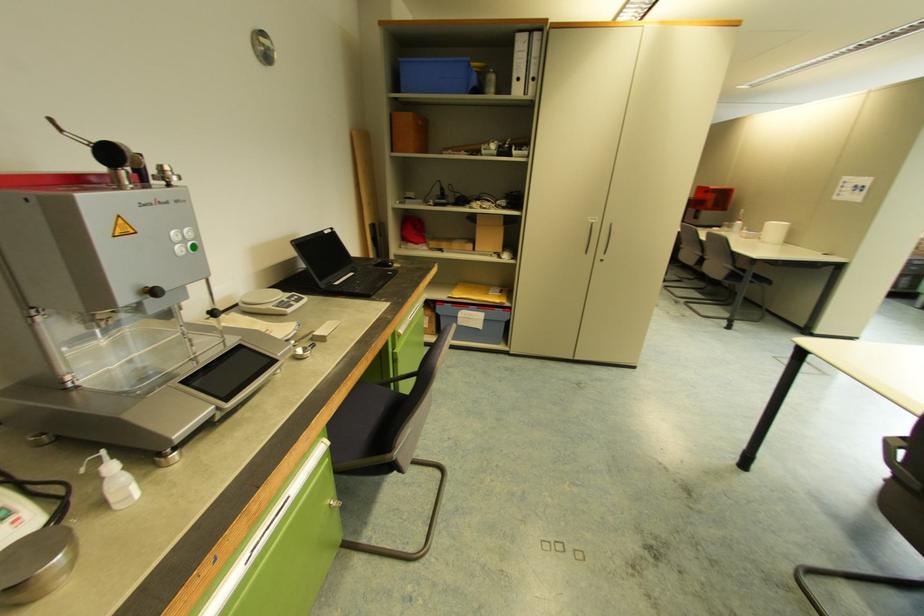
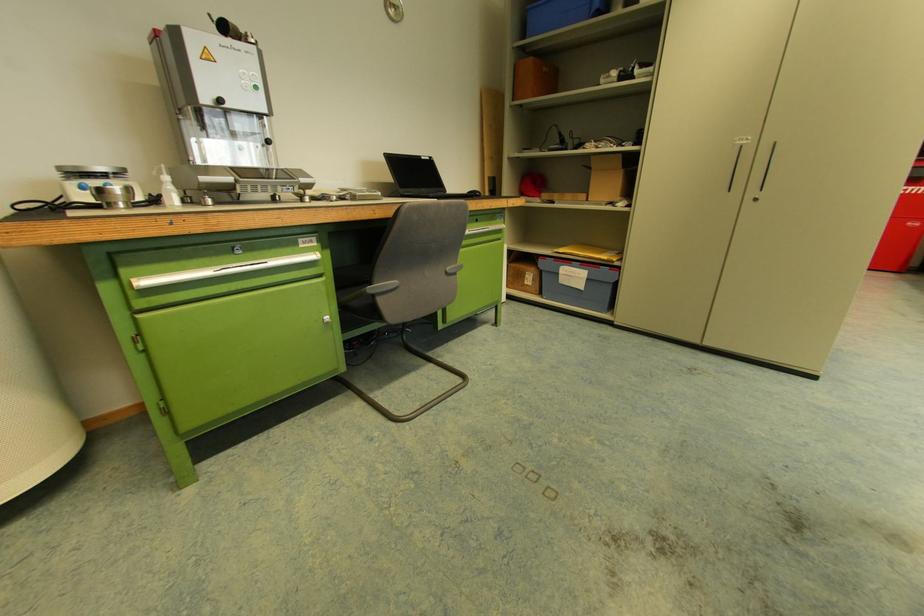
Find the pixel in the second image that matches (x=597, y=221) in the first image.

(748, 142)